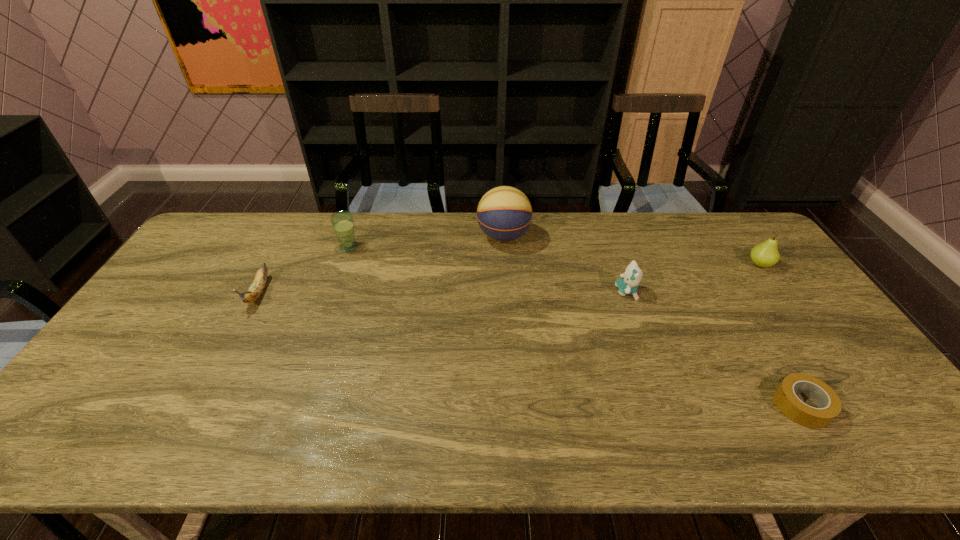
Locate an element on the screen. vacant space located 0.070m at the edge of the duct tape is located at coordinates (744, 406).

Identify the location of basketball that is at the far edge. (504, 214).

This screenshot has width=960, height=540. In order to click on glass located in the far edge section of the desktop in this screenshot , I will do `click(342, 222)`.

The height and width of the screenshot is (540, 960). Find the location of `object present at the near edge`. object present at the near edge is located at coordinates (829, 405).

Where is `pear positioned at the right edge`? This screenshot has width=960, height=540. pear positioned at the right edge is located at coordinates (766, 254).

I want to click on duct tape positioned at the right edge, so click(x=829, y=405).

You are a GUI agent. You are given a task and a screenshot of the screen. Output one action in this format:
    pyautogui.click(x=<x>, y=<y>)
    Task: Click on the object situated at the near right corner
    This screenshot has height=540, width=960.
    Given the screenshot: What is the action you would take?
    pyautogui.click(x=829, y=405)

The width and height of the screenshot is (960, 540). Find the location of `vacant space at the far edge of the desktop`. vacant space at the far edge of the desktop is located at coordinates (323, 215).

Locate an element on the screen. This screenshot has width=960, height=540. free space at the near edge of the desktop is located at coordinates coord(153,422).

Where is `free space at the left edge of the desktop`? free space at the left edge of the desktop is located at coordinates (191, 271).